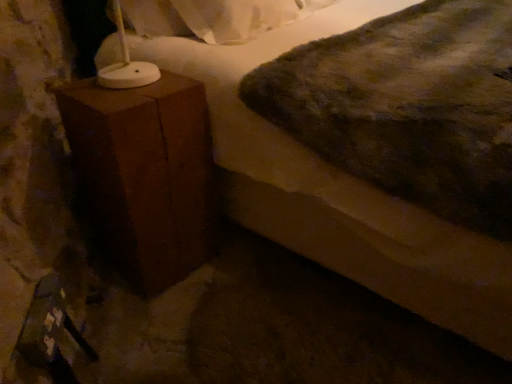
You are a GUI agent. You are given a task and a screenshot of the screen. Output one action in this format:
    pyautogui.click(x=<x>, y=<y>)
    Task: Click on the vacant space to the right of brown wood side table at left
    
    Given the screenshot: What is the action you would take?
    pyautogui.click(x=234, y=259)